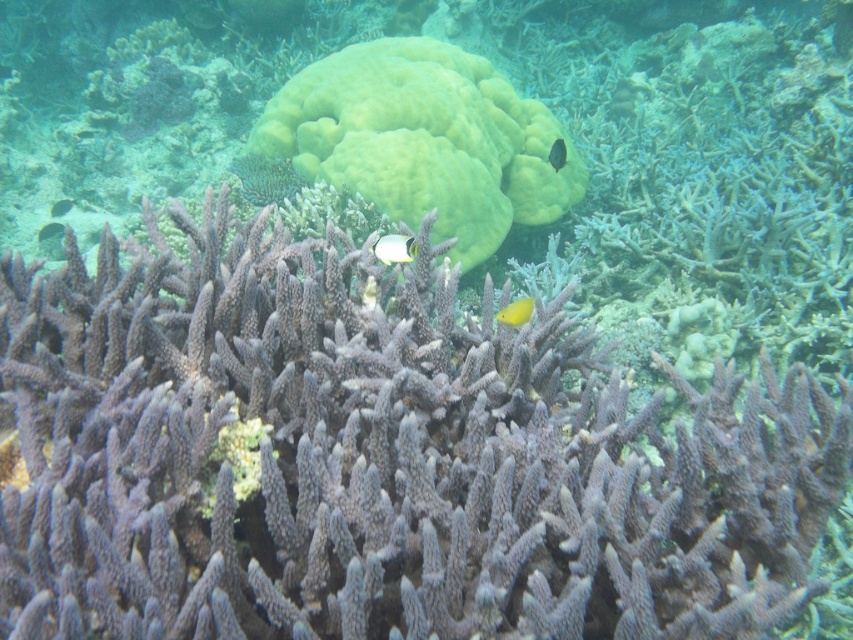
Is point (509, 321) behind point (555, 168)?

That is False.

Does yellow matte fish at center have a larger size compared to shiny black fish at center?

No, yellow matte fish at center is not bigger than shiny black fish at center.

Between point (521, 305) and point (556, 163), which one is positioned behind?

Positioned behind is point (556, 163).

Identify the location of yellow matte fish at center. (515, 312).

Looking at this image, is green matte coral at center positioned in front of yellow matte fish at center?

No, it is behind yellow matte fish at center.

Based on the photo, can you confirm if green matte coral at center is positioned below yellow matte fish at center?

No, green matte coral at center is not below yellow matte fish at center.

Identify the location of green matte coral at center. point(422,140).

Is point (502, 308) farther from viewer compared to point (53, 209)?

No, (502, 308) is closer to viewer.

Does yellow matte fish at center have a larger size compared to translucent yellow fish at center?

No.

Where is `yellow matte fish at center`? The width and height of the screenshot is (853, 640). yellow matte fish at center is located at coordinates tap(515, 312).